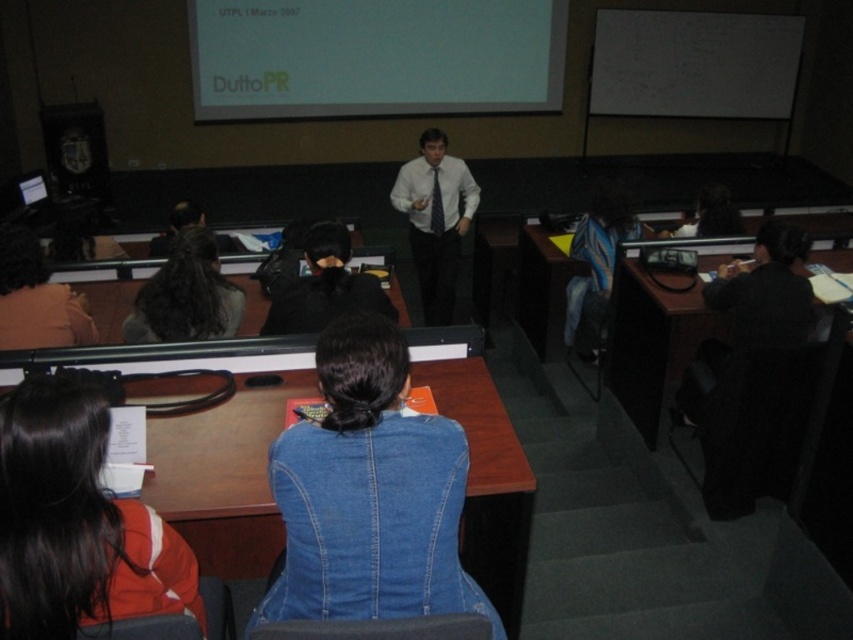
Question: Does denim jacket at center appear on the right side of dark brown hair at center?

Choices:
 (A) no
 (B) yes

Answer: (B)

Question: Which point is farther to the camera?

Choices:
 (A) (22, 292)
 (B) (460, 196)
 (C) (86, 605)

Answer: (B)

Question: In this image, where is white matte projection screen at upper center located relative to dark brown hair at center?

Choices:
 (A) left
 (B) right

Answer: (B)

Question: Is wooden desk at center above dark brown hair at center?

Choices:
 (A) yes
 (B) no

Answer: (B)

Question: Which of the following is the closest to the observer?

Choices:
 (A) white shirt at center
 (B) denim jacket at center
 (C) denim jacket at lower left
 (D) wooden desk at center

Answer: (C)

Question: Which point is closer to the camera?

Choices:
 (A) (570, 346)
 (B) (437, 134)
 (C) (346, 234)

Answer: (C)